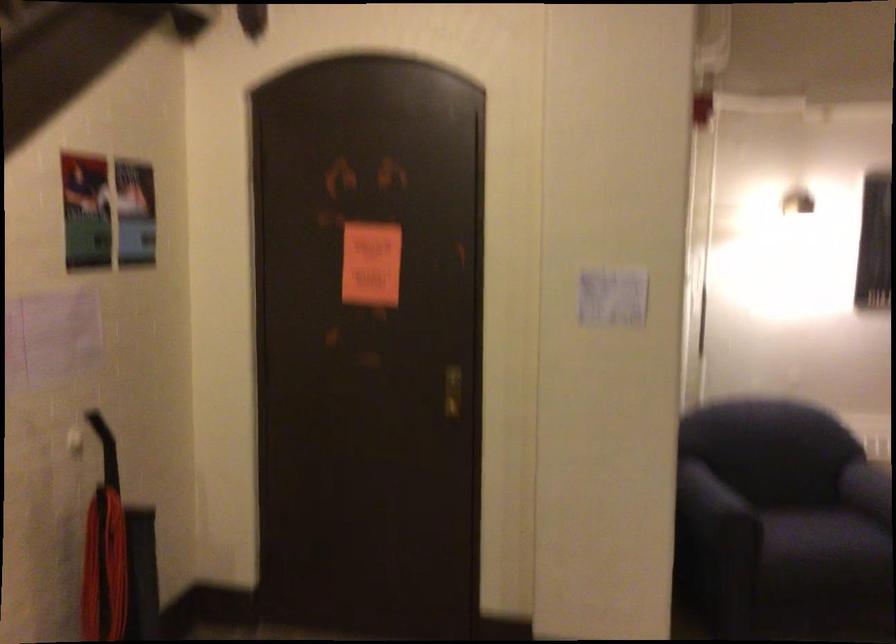
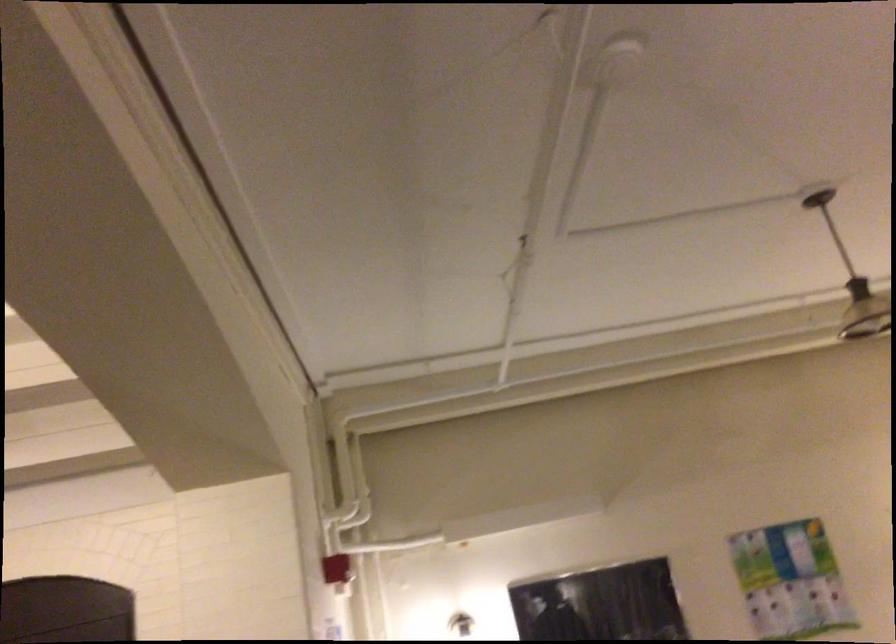
The first image is from the beginning of the video and the second image is from the end. How did the camera likely rotate when shooting the video?

The camera's rotation is toward right-up.